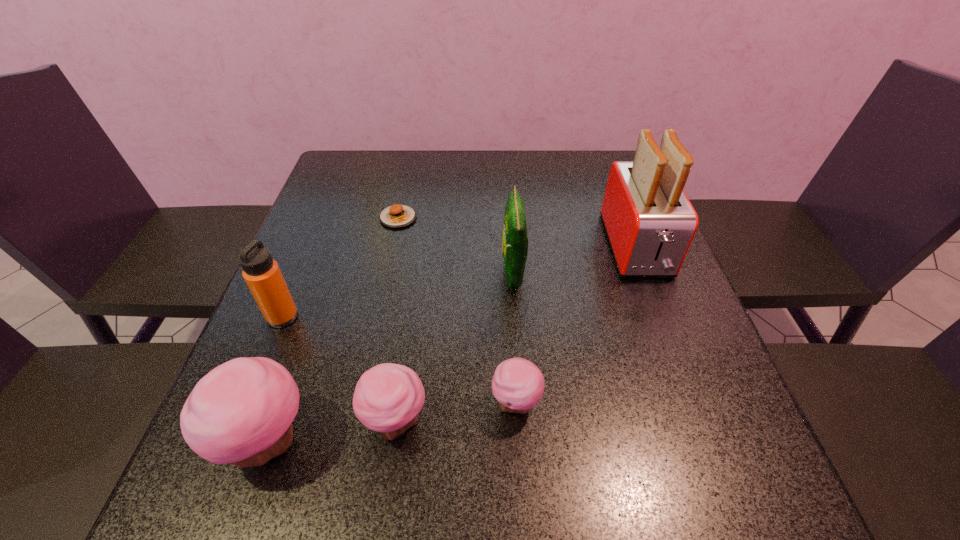
What are the coordinates of `thermos bottle that is positioned at the left edge` in the screenshot? It's located at 261,272.

What are the coordinates of `object that is at the right edge` in the screenshot? It's located at (650, 223).

At what (x,y) coordinates should I click in order to perform the action: click on object located in the near left corner section of the desktop. Please return your answer as a coordinate pair (x, y). The height and width of the screenshot is (540, 960). Looking at the image, I should click on (241, 412).

In the image, there is a desktop. At what (x,y) coordinates should I click in order to perform the action: click on vacant space at the far edge. Please return your answer as a coordinate pair (x, y). Looking at the image, I should click on (435, 178).

In the image, there is a desktop. Where is `vacant area at the near edge`? vacant area at the near edge is located at coordinates (583, 439).

This screenshot has width=960, height=540. I want to click on vacant space at the left edge of the desktop, so click(318, 303).

In the image, there is a desktop. Where is `vacant space at the far left corner`? The height and width of the screenshot is (540, 960). vacant space at the far left corner is located at coordinates (359, 164).

What are the coordinates of `vacant region at the near right corner of the desktop` in the screenshot? It's located at (705, 429).

You are a GUI agent. You are given a task and a screenshot of the screen. Output one action in this format:
    pyautogui.click(x=<x>, y=<y>)
    Task: Click on the free spot between the tallest cupcake and the crisp (potato chip)
    The image size is (960, 540).
    Given the screenshot: What is the action you would take?
    pyautogui.click(x=391, y=357)

Identify the location of free spot between the third shortest object and the crisp (potato chip). The width and height of the screenshot is (960, 540). (454, 348).